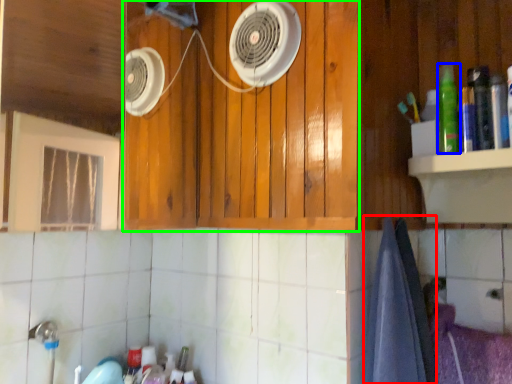
Question: Which object is positioned closest to bath towel (highlighted by a red box)? Select from bottle (highlighted by a blue box) and cabinetry (highlighted by a green box).

Choices:
 (A) bottle
 (B) cabinetry

Answer: (A)